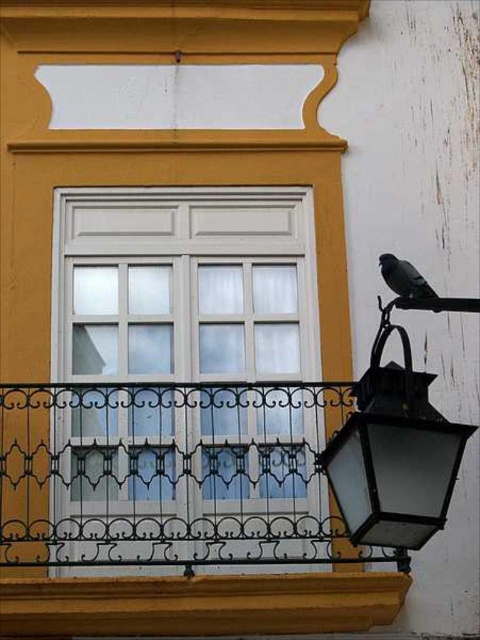
You are standing in front of the building and want to hang a new decoration. You have two options to place either the white painted wood window at center or the black glass lantern at lower right. Based on their positions, which object is closer to you and thus a better choice for a decoration that needs to be easily accessible?

The white painted wood window at center is closer to you than the black glass lantern at lower right, so it would be a better choice for a decoration that needs to be easily accessible.

Consider the image. You are standing in front of the building and notice the white painted wood window at center and the black glass lantern at lower right. Which object is located more to the right side?

The black glass lantern at lower right is more to the right side because the white painted wood window at center is positioned on the left side of it.

You are an architect designing a new building and want to ensure that the white painted wood window at center and the black wrought iron at lower right are proportionate. Based on the image, which object is taller and should be considered for scaling adjustments?

The white painted wood window at center is taller than the black wrought iron at lower right, so scaling adjustments should focus on ensuring the black wrought iron at lower right is proportionate in height relative to the window.